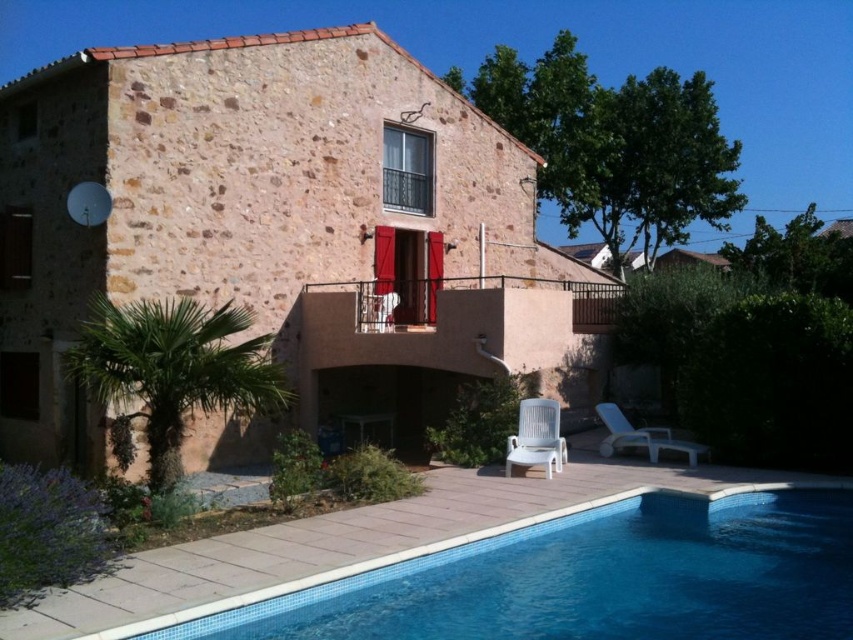
You are standing on the patio near the house and want to sit down. There is a white plastic chair at lower right and a blue tile swimming pool at lower center. Which object is closer to your current position if you are facing the pool?

The white plastic chair at lower right is closer to your current position because the blue tile swimming pool at lower center is to the right of the chair, implying the chair is nearer to the patio where you are standing.

In the scene shown: You are a landscape architect planning to install a new garden feature between the brown stone villa at center and the blue tile swimming pool at lower center. Considering their sizes, which object should the feature be closer to and why?

The garden feature should be closer to the blue tile swimming pool at lower center because the brown stone villa at center is larger in size, so placing the feature near the smaller object would maintain a balanced layout.